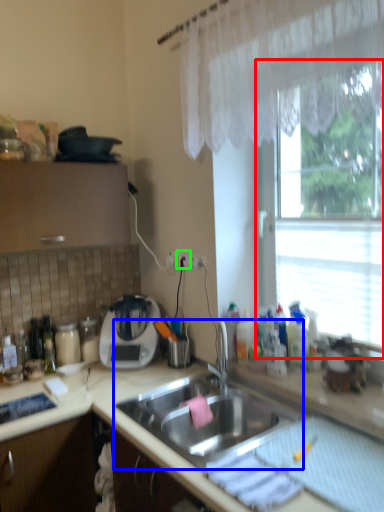
Question: Based on their relative distances, which object is farther from window (highlighted by a red box)? Choose from sink (highlighted by a blue box) and electric outlet (highlighted by a green box).

Choices:
 (A) sink
 (B) electric outlet

Answer: (A)